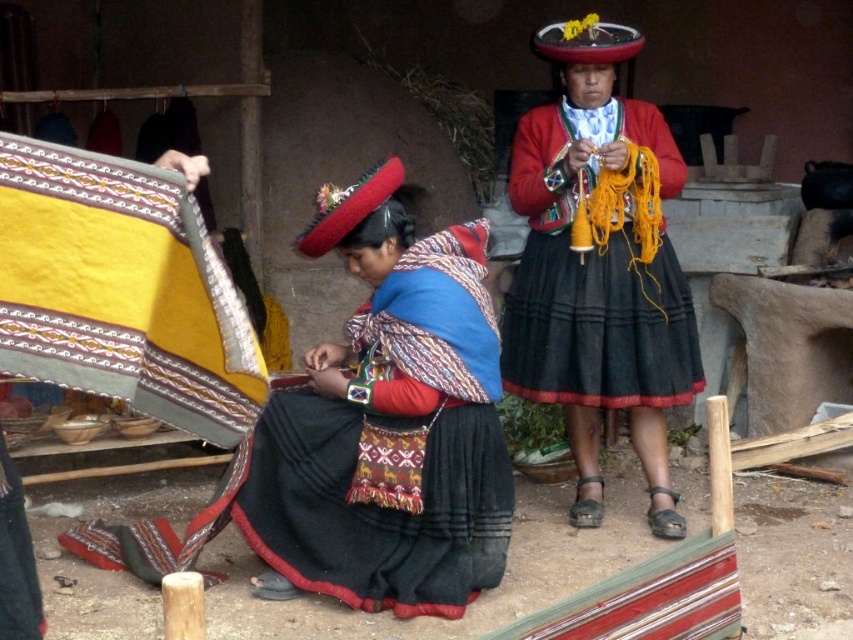
Question: Can you confirm if black woven skirt at lower left is wider than matte black skirt at center?

Choices:
 (A) yes
 (B) no

Answer: (A)

Question: Is black woven skirt at lower left closer to camera compared to matte black skirt at center?

Choices:
 (A) yes
 (B) no

Answer: (A)

Question: Which point is closer to the camera taking this photo?

Choices:
 (A) (526, 396)
 (B) (495, 368)

Answer: (B)

Question: Is black woven skirt at lower left above matte black skirt at center?

Choices:
 (A) no
 (B) yes

Answer: (A)